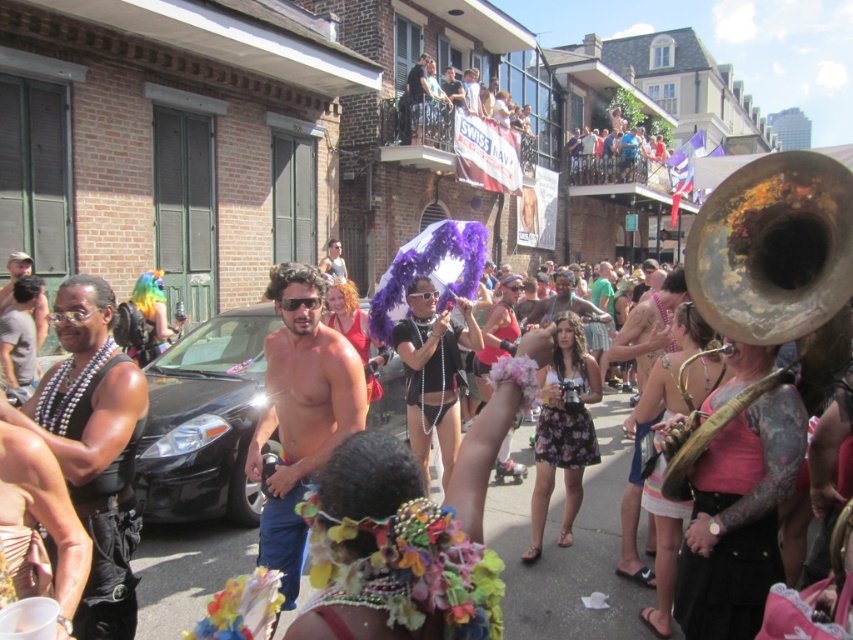
Is point (78, 420) positioned before point (427, 122)?

Yes, it is.

At what (x,y) coordinates should I click in order to perform the action: click on black leather vest at center. Please return your answer as a coordinate pair (x, y). This screenshot has height=640, width=853. Looking at the image, I should click on (93, 445).

Does point (76, 481) come behind point (425, 84)?

No, (76, 481) is closer to viewer.

Locate an element on the screen. The width and height of the screenshot is (853, 640). black leather vest at center is located at coordinates (93, 445).

Who is lower down, shiny gold necklace at center or shiny black tank top at upper center?

shiny gold necklace at center is lower down.

Who is positioned more to the right, shiny gold necklace at center or shiny black tank top at upper center?

Positioned to the right is shiny gold necklace at center.

Which is behind, point (669, 276) or point (428, 109)?

The point (428, 109) is more distant.

You are a GUI agent. You are given a task and a screenshot of the screen. Output one action in this format:
    pyautogui.click(x=<x>, y=<y>)
    Task: Click on the shiny gold necklace at center
    The image size is (853, 640).
    Given the screenshot: What is the action you would take?
    pyautogui.click(x=648, y=326)

Is black matte car at center to the left of shiny black tank top at upper center from the viewer's perspective?

Indeed, black matte car at center is positioned on the left side of shiny black tank top at upper center.

Can you confirm if black matte car at center is thinner than shiny black tank top at upper center?

Incorrect, black matte car at center's width is not less than shiny black tank top at upper center's.

Where is `black matte car at center`? black matte car at center is located at coordinates click(204, 420).

Find the location of a particular element. The height and width of the screenshot is (640, 853). black matte car at center is located at coordinates (204, 420).